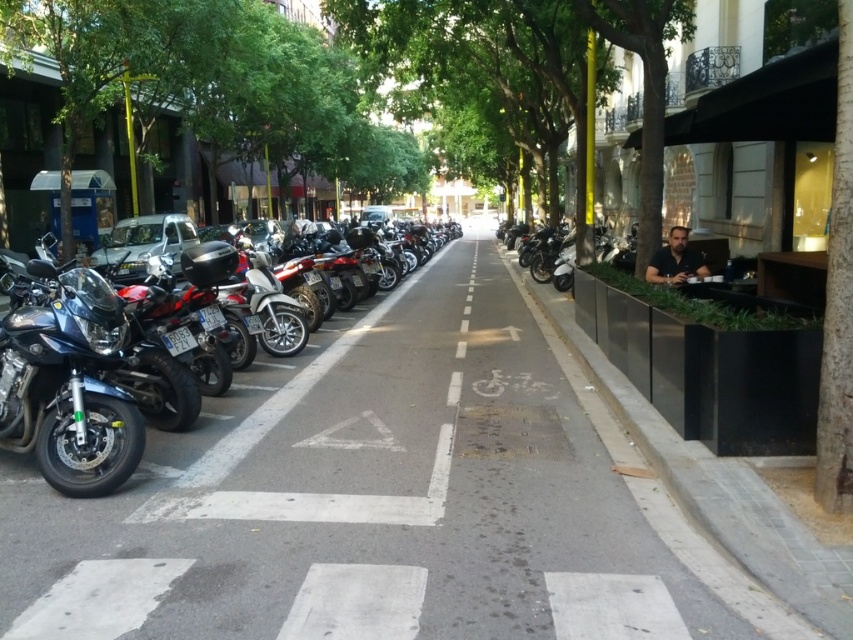
Question: Estimate the real-world distances between objects in this image. Which object is closer to the green leafy tree at right?

Choices:
 (A) gray asphalt at center
 (B) black concrete curb at right

Answer: (A)

Question: Which point appears closest to the camera in this image?

Choices:
 (A) (796, 605)
 (B) (346, 333)
 (C) (645, 180)

Answer: (A)

Question: Is gray asphalt at center bigger than shiny black motorcycle at left?

Choices:
 (A) yes
 (B) no

Answer: (B)

Question: Considering the real-world distances, which object is farthest from the gray asphalt at center?

Choices:
 (A) green leafy tree at right
 (B) shiny black motorcycle at left
 (C) black concrete curb at right

Answer: (C)

Question: Does gray asphalt at center have a larger size compared to black concrete curb at right?

Choices:
 (A) no
 (B) yes

Answer: (B)

Question: Considering the relative positions of black concrete curb at right and green leafy tree at right in the image provided, where is black concrete curb at right located with respect to green leafy tree at right?

Choices:
 (A) left
 (B) right

Answer: (A)